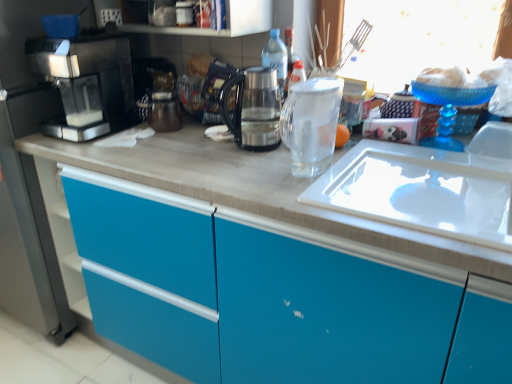
Question: Can you confirm if sleek black coffee machine at left is positioned to the right of clear plastic bottle at center?

Choices:
 (A) no
 (B) yes

Answer: (A)

Question: From a real-world perspective, does sleek black coffee machine at left sit lower than clear plastic bottle at center?

Choices:
 (A) yes
 (B) no

Answer: (A)

Question: From the image's perspective, is sleek black coffee machine at left below clear plastic bottle at center?

Choices:
 (A) yes
 (B) no

Answer: (A)

Question: Considering the relative sizes of sleek black coffee machine at left and clear plastic bottle at center in the image provided, is sleek black coffee machine at left smaller than clear plastic bottle at center?

Choices:
 (A) no
 (B) yes

Answer: (A)

Question: Is sleek black coffee machine at left bigger than clear plastic bottle at center?

Choices:
 (A) yes
 (B) no

Answer: (A)

Question: Can you confirm if sleek black coffee machine at left is positioned to the left of clear plastic bottle at center?

Choices:
 (A) no
 (B) yes

Answer: (B)

Question: Is transparent glass at center directly adjacent to clear glass pitcher at center, the 2th kitchen appliance in the left-to-right sequence?

Choices:
 (A) yes
 (B) no

Answer: (B)

Question: Can you confirm if transparent glass at center is taller than clear glass pitcher at center, the first kitchen appliance when ordered from right to left?

Choices:
 (A) no
 (B) yes

Answer: (A)

Question: From a real-world perspective, is transparent glass at center beneath clear glass pitcher at center, the first kitchen appliance when ordered from right to left?

Choices:
 (A) yes
 (B) no

Answer: (A)

Question: Can clear glass pitcher at center, the 2th kitchen appliance in the left-to-right sequence, be found inside transparent glass at center?

Choices:
 (A) no
 (B) yes

Answer: (A)

Question: From a real-world perspective, does transparent glass at center stand above clear glass pitcher at center, the first kitchen appliance when ordered from right to left?

Choices:
 (A) no
 (B) yes

Answer: (A)

Question: Is transparent glass at center positioned behind clear glass pitcher at center, the first kitchen appliance when ordered from right to left?

Choices:
 (A) yes
 (B) no

Answer: (A)

Question: Is sleek black coffee machine at left smaller than transparent glass at center?

Choices:
 (A) no
 (B) yes

Answer: (A)